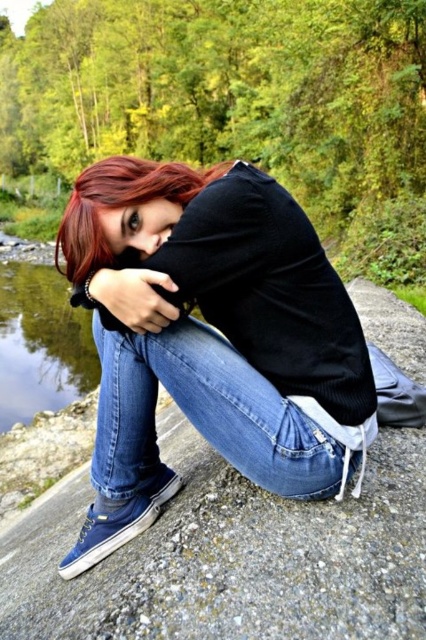
You are a photographer aiming to capture a closeup of the blue denim jeans at center and the clear water at lower left in the scene. Given their sizes, which object should you focus on first to ensure both fit in the frame without needing to adjust your camera angle?

The blue denim jeans at center has a smaller size compared to clear water at lower left, so you should focus on the blue denim jeans at center first to ensure both fit in the frame without needing to adjust your camera angle.

You are a photographer trying to capture the subject in this scene. Since the blue denim jeans at center and the denim jeans at lower center are overlapping, which one is covering the other?

The blue denim jeans at center is positioned over denim jeans at lower center, so the blue denim jeans at center is covering the denim jeans at lower center.